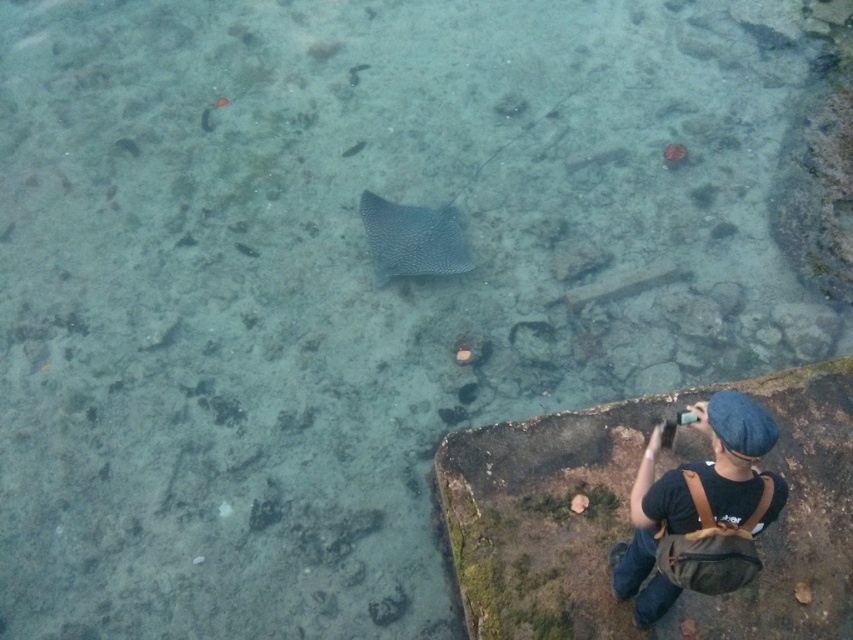
Where is `brown leather backpack at lower right`? brown leather backpack at lower right is located at coordinates (700, 509).

From the picture: Who is more forward, (721, 422) or (376, 198)?

Point (721, 422) is in front.

Does point (758, 502) come in front of point (434, 248)?

Yes, it is in front of point (434, 248).

I want to click on brown leather backpack at lower right, so click(700, 509).